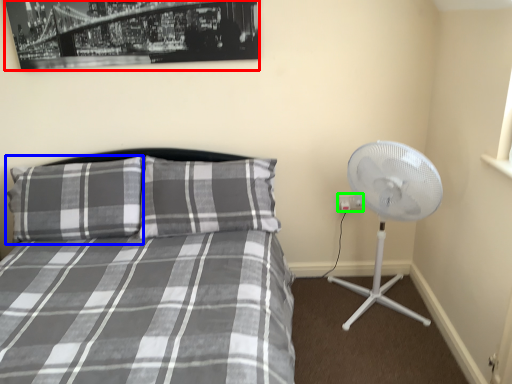
Question: Which object is the farthest from picture frame (highlighted by a red box)? Choose among these: pillow (highlighted by a blue box) or electric outlet (highlighted by a green box).

Choices:
 (A) pillow
 (B) electric outlet

Answer: (B)